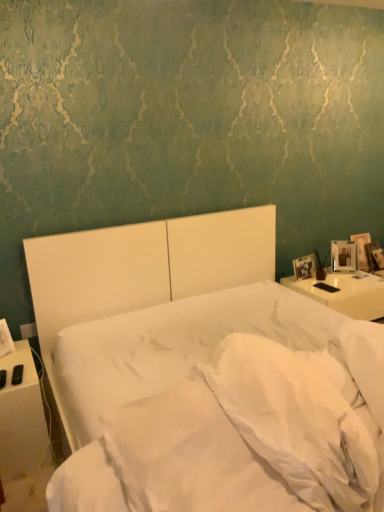
Question: Does white glossy nightstand at right, which is the 1th nightstand in back-to-front order, turn towards white soft pillow at lower right, arranged as the second pillow when viewed from the left?

Choices:
 (A) yes
 (B) no

Answer: (B)

Question: Can you confirm if white glossy nightstand at right, placed as the 2th nightstand when sorted from left to right, is wider than white soft pillow at lower right, which is the first pillow in right-to-left order?

Choices:
 (A) no
 (B) yes

Answer: (B)

Question: Is white glossy nightstand at right, marked as the 2th nightstand in a front-to-back arrangement, in front of white soft pillow at lower right, arranged as the second pillow when viewed from the left?

Choices:
 (A) no
 (B) yes

Answer: (A)

Question: Considering the relative positions of white glossy nightstand at right, which is the 1th nightstand in back-to-front order, and white soft pillow at lower right, arranged as the second pillow when viewed from the left, in the image provided, is white glossy nightstand at right, which is the 1th nightstand in back-to-front order, to the right of white soft pillow at lower right, arranged as the second pillow when viewed from the left, from the viewer's perspective?

Choices:
 (A) yes
 (B) no

Answer: (A)

Question: Does white glossy nightstand at right, which is the 1th nightstand in back-to-front order, have a greater height compared to white soft pillow at lower right, arranged as the second pillow when viewed from the left?

Choices:
 (A) no
 (B) yes

Answer: (B)

Question: Would you consider white glossy nightstand at right, which ranks as the first nightstand in right-to-left order, to be distant from white soft pillow at lower right, arranged as the second pillow when viewed from the left?

Choices:
 (A) no
 (B) yes

Answer: (B)

Question: Is white soft pillow at lower right, which is the first pillow in right-to-left order, facing away from white glossy nightstand at right, which is the 1th nightstand in back-to-front order?

Choices:
 (A) yes
 (B) no

Answer: (B)

Question: From the image's perspective, is white soft pillow at lower right, arranged as the second pillow when viewed from the left, beneath white glossy nightstand at right, which is the 1th nightstand in back-to-front order?

Choices:
 (A) no
 (B) yes

Answer: (B)

Question: From a real-world perspective, is white soft pillow at lower right, which is the first pillow in right-to-left order, physically below white glossy nightstand at right, marked as the 2th nightstand in a front-to-back arrangement?

Choices:
 (A) no
 (B) yes

Answer: (A)

Question: Considering the relative positions of white soft pillow at lower right, which is the first pillow in right-to-left order, and white glossy nightstand at right, which is the 1th nightstand in back-to-front order, in the image provided, is white soft pillow at lower right, which is the first pillow in right-to-left order, to the right of white glossy nightstand at right, which is the 1th nightstand in back-to-front order, from the viewer's perspective?

Choices:
 (A) yes
 (B) no

Answer: (B)

Question: Would you say white soft pillow at lower right, arranged as the second pillow when viewed from the left, is a long distance from white glossy nightstand at right, placed as the 2th nightstand when sorted from left to right?

Choices:
 (A) no
 (B) yes

Answer: (B)

Question: Is white soft pillow at lower right, which is the first pillow in right-to-left order, positioned behind white glossy nightstand at right, which is the 1th nightstand in back-to-front order?

Choices:
 (A) yes
 (B) no

Answer: (B)

Question: Considering the relative positions of white matte bed at center and white soft pillow at center, marked as the first pillow in a left-to-right arrangement, in the image provided, is white matte bed at center behind white soft pillow at center, marked as the first pillow in a left-to-right arrangement,?

Choices:
 (A) yes
 (B) no

Answer: (B)